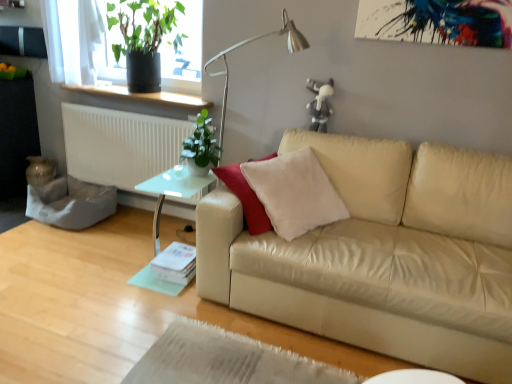
Find the location of `free space above white plastic radiator at left (from a real-world perspective)`. free space above white plastic radiator at left (from a real-world perspective) is located at coordinates (130, 107).